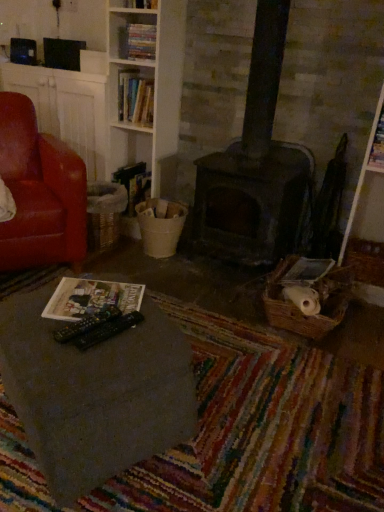
This screenshot has height=512, width=384. In order to click on vacant region above smooth gray table at lower left (from a real-world perspective) in this screenshot , I will do `click(91, 312)`.